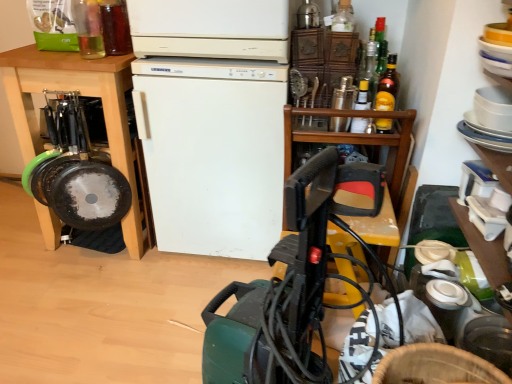
Question: From the image's perspective, is clear glass bottle at upper left, acting as the sixth bottle starting from the right, on top of yellow glass bottle at upper center, arranged as the third bottle when viewed from the right?

Choices:
 (A) no
 (B) yes

Answer: (B)

Question: From the image's perspective, is clear glass bottle at upper left, which appears as the first bottle when viewed from the left, located beneath yellow glass bottle at upper center, the 4th bottle when ordered from left to right?

Choices:
 (A) no
 (B) yes

Answer: (A)

Question: Is clear glass bottle at upper left, which appears as the first bottle when viewed from the left, oriented towards yellow glass bottle at upper center, the 4th bottle when ordered from left to right?

Choices:
 (A) yes
 (B) no

Answer: (B)

Question: Is clear glass bottle at upper left, acting as the sixth bottle starting from the right, at the left side of yellow glass bottle at upper center, arranged as the third bottle when viewed from the right?

Choices:
 (A) no
 (B) yes

Answer: (B)

Question: Is clear glass bottle at upper left, which appears as the first bottle when viewed from the left, located outside yellow glass bottle at upper center, the 4th bottle when ordered from left to right?

Choices:
 (A) yes
 (B) no

Answer: (A)

Question: From a real-world perspective, is clear glass bottle at upper left, which appears as the first bottle when viewed from the left, located higher than yellow glass bottle at upper center, the 4th bottle when ordered from left to right?

Choices:
 (A) no
 (B) yes

Answer: (B)

Question: Is wooden at upper right bigger than clear glass bottle at upper left, acting as the sixth bottle starting from the right?

Choices:
 (A) yes
 (B) no

Answer: (A)

Question: Is wooden at upper right to the left of clear glass bottle at upper left, which appears as the first bottle when viewed from the left, from the viewer's perspective?

Choices:
 (A) no
 (B) yes

Answer: (A)

Question: Is clear glass bottle at upper left, acting as the sixth bottle starting from the right, at the back of wooden at upper right?

Choices:
 (A) yes
 (B) no

Answer: (B)

Question: From the image's perspective, is wooden at upper right on clear glass bottle at upper left, which appears as the first bottle when viewed from the left?

Choices:
 (A) no
 (B) yes

Answer: (A)

Question: Considering the relative sizes of wooden at upper right and clear glass bottle at upper left, acting as the sixth bottle starting from the right, in the image provided, is wooden at upper right taller than clear glass bottle at upper left, acting as the sixth bottle starting from the right,?

Choices:
 (A) yes
 (B) no

Answer: (A)

Question: Is wooden at upper right at the right side of clear glass bottle at upper left, which appears as the first bottle when viewed from the left?

Choices:
 (A) no
 (B) yes

Answer: (B)

Question: Does translucent glass bottle at upper right, which is the 2th bottle from right to left, turn towards clear glass bottle at upper left, which appears as the first bottle when viewed from the left?

Choices:
 (A) no
 (B) yes

Answer: (A)